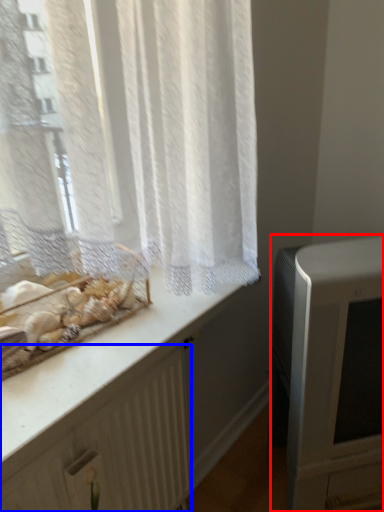
Question: Which object appears closest to the camera in this image, appliance (highlighted by a red box) or radiator (highlighted by a blue box)?

Choices:
 (A) appliance
 (B) radiator

Answer: (B)